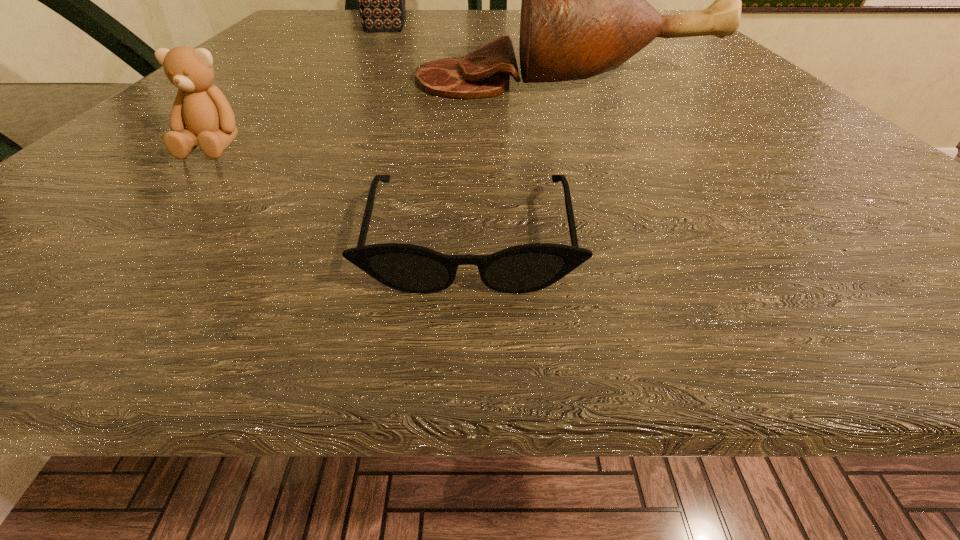
Find the location of a particular element. The height and width of the screenshot is (540, 960). clutch bag is located at coordinates (381, 0).

You are a GUI agent. You are given a task and a screenshot of the screen. Output one action in this format:
    pyautogui.click(x=<x>, y=<y>)
    Task: Click on the farthest object
    The width and height of the screenshot is (960, 540).
    Given the screenshot: What is the action you would take?
    pyautogui.click(x=381, y=0)

Identify the location of ham. The height and width of the screenshot is (540, 960). (584, 11).

Image resolution: width=960 pixels, height=540 pixels. Identify the location of the third nearest object. (584, 11).

Locate an element on the screen. the third farthest object is located at coordinates (203, 109).

Locate an element on the screen. the leftmost object is located at coordinates (203, 109).

Where is `sunglasses`? This screenshot has height=540, width=960. sunglasses is located at coordinates (525, 268).

The width and height of the screenshot is (960, 540). What are the coordinates of `the nearest object` in the screenshot? It's located at (525, 268).

What are the coordinates of `vacant region located 0.130m with the zip open on the clutch bag` in the screenshot? It's located at (479, 30).

Locate an element on the screen. The image size is (960, 540). free space located 0.210m at the sliced end of the third nearest object is located at coordinates (272, 79).